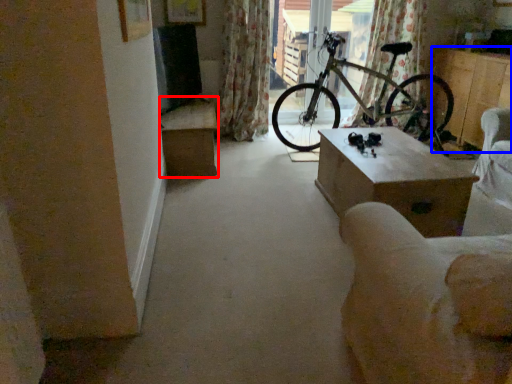
Question: Which point is further to the camera, table (highlighted by a red box) or furniture (highlighted by a blue box)?

Choices:
 (A) table
 (B) furniture

Answer: (B)